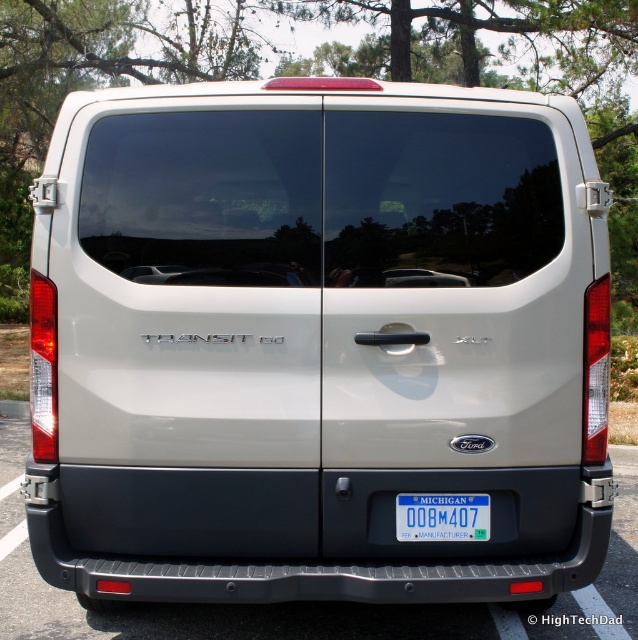
Does point (464, 620) come closer to viewer compared to point (397, 532)?

No, (464, 620) is further to viewer.

Does gray rubber bumper at lower center appear on the right side of blue plastic license plate at center?

In fact, gray rubber bumper at lower center is to the left of blue plastic license plate at center.

Measure the distance between point (4, 621) and camera.

The distance of point (4, 621) from camera is 3.99 meters.

You are a GUI agent. You are given a task and a screenshot of the screen. Output one action in this format:
    pyautogui.click(x=<x>, y=<y>)
    Task: Click on the gray rubber bumper at lower center
    The image size is (638, 640).
    Given the screenshot: What is the action you would take?
    pyautogui.click(x=299, y=602)